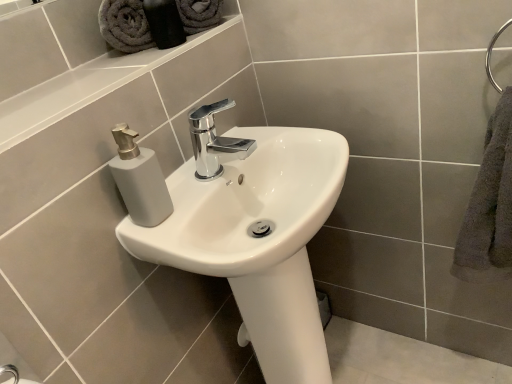
You are a GUI agent. You are given a task and a screenshot of the screen. Output one action in this format:
    pyautogui.click(x=<x>, y=<y>)
    Task: Click on the blank area to the left of gray cotton towel at upper left, positioned as the 1th bath towel in left-to-right order
    Image resolution: width=512 pixels, height=384 pixels.
    Given the screenshot: What is the action you would take?
    pyautogui.click(x=68, y=64)